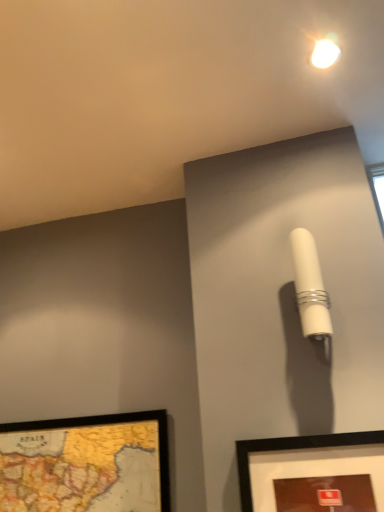
Question: From their relative heights in the image, would you say white matte cylindrical lamp at upper right is taller or shorter than matte black picture frame at lower right, which ranks as the second picture frame in back-to-front order?

Choices:
 (A) tall
 (B) short

Answer: (A)

Question: Is point pos(321,331) positioned closer to the camera than point pos(307,454)?

Choices:
 (A) farther
 (B) closer

Answer: (A)

Question: Estimate the real-world distances between objects in this image. Which object is closer to the white matte cylindrical lamp at upper right?

Choices:
 (A) wooden map frame at lower left, marked as the second picture frame in a front-to-back arrangement
 (B) matte black picture frame at lower right, placed as the 2th picture frame when sorted from left to right
 (C) white glossy droplight at upper center

Answer: (B)

Question: Estimate the real-world distances between objects in this image. Which object is closer to the matte black picture frame at lower right, placed as the 2th picture frame when sorted from left to right?

Choices:
 (A) white matte cylindrical lamp at upper right
 (B) wooden map frame at lower left, positioned as the 1th picture frame in left-to-right order
 (C) white glossy droplight at upper center

Answer: (A)